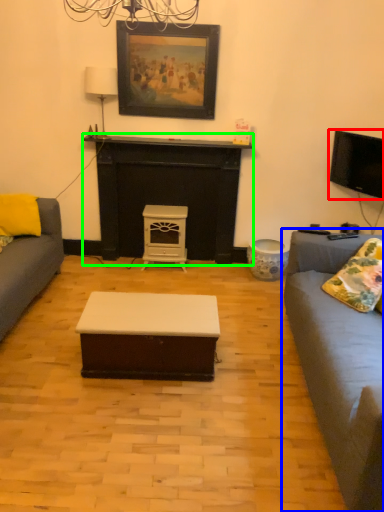
Question: Which object is positioned closest to television (highlighted by a red box)? Select from studio couch (highlighted by a blue box) and fireplace (highlighted by a green box).

Choices:
 (A) studio couch
 (B) fireplace

Answer: (A)